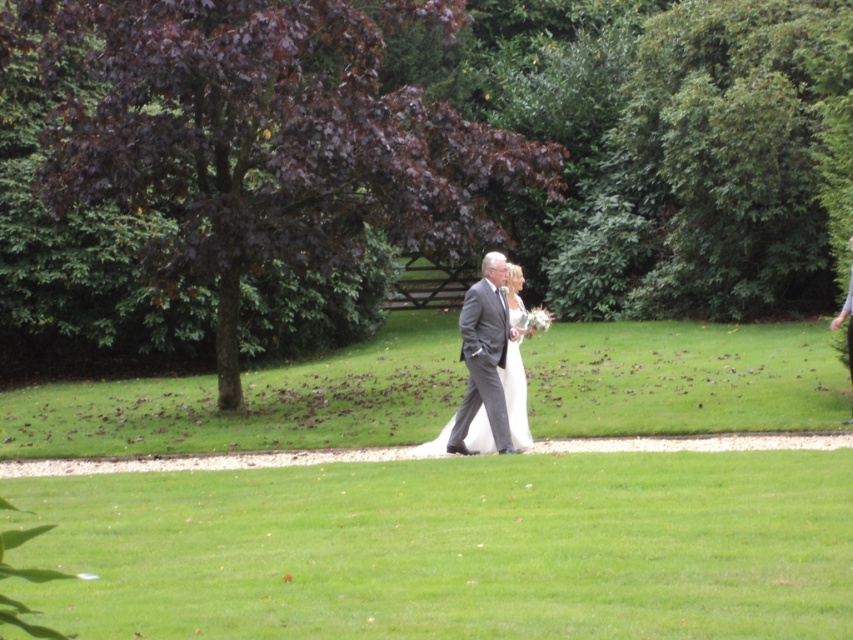
Who is positioned more to the left, green grass at center or gray suit at center?

From the viewer's perspective, green grass at center appears more on the left side.

Can you confirm if green grass at center is positioned to the right of gray suit at center?

No, green grass at center is not to the right of gray suit at center.

Is point (766, 620) positioned after point (490, 304)?

No, it is in front of (490, 304).

The width and height of the screenshot is (853, 640). Find the location of `green grass at center`. green grass at center is located at coordinates (451, 548).

Is point (264, 630) more distant than point (838, 316)?

That is False.

Can you confirm if green grass at center is bigger than white satin dress at center?

No.

Is point (126, 632) behind point (849, 420)?

That is False.

You are a GUI agent. You are given a task and a screenshot of the screen. Output one action in this format:
    pyautogui.click(x=<x>, y=<y>)
    Task: Click on the green grass at center
    The image size is (853, 640).
    Given the screenshot: What is the action you would take?
    pyautogui.click(x=451, y=548)

Which is behind, point (477, 372) or point (848, 422)?

The point (848, 422) is more distant.

Is gray suit at center positioned before white satin dress at center?

Yes, it is.

Who is more distant from viewer, (467, 422) or (850, 372)?

Point (850, 372)

Identify the location of gray suit at center. The width and height of the screenshot is (853, 640). (485, 356).